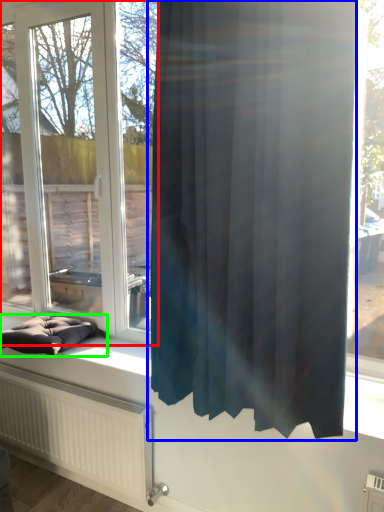
Question: Considering the real-world distances, which object is closest to window (highlighted by a red box)? curtain (highlighted by a blue box) or furniture (highlighted by a green box).

Choices:
 (A) curtain
 (B) furniture

Answer: (B)